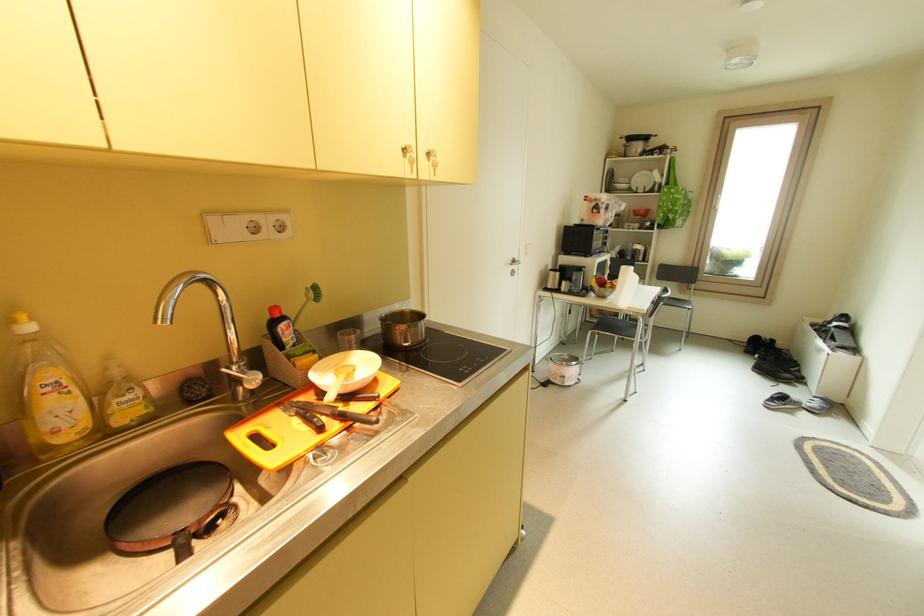
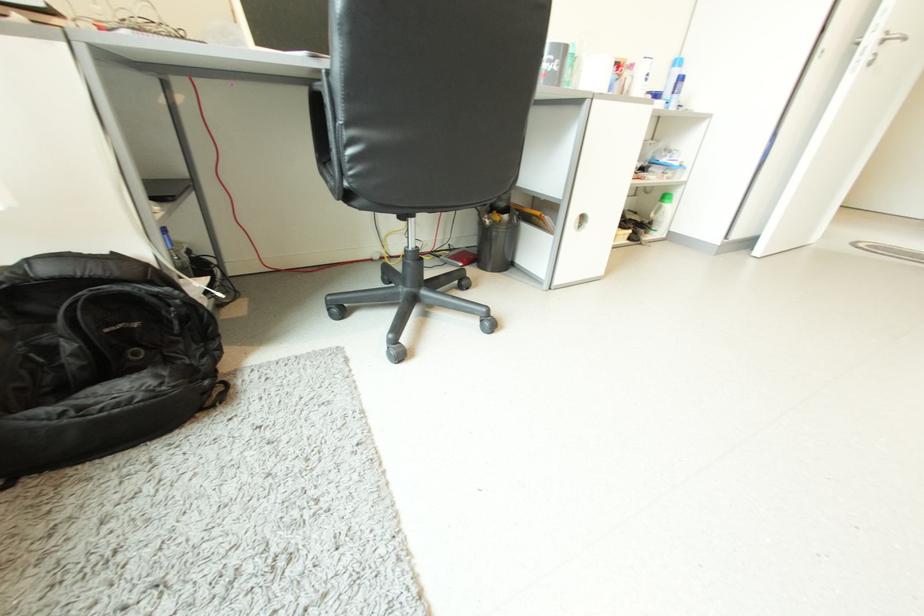
Question: I am providing you with two images of the same scene from different viewpoints. Please identify which objects are invisible in image2.

Choices:
 (A) knife handle
 (B) blue aerosol can
 (C) green bar soap
 (D) metal door handle

Answer: (A)